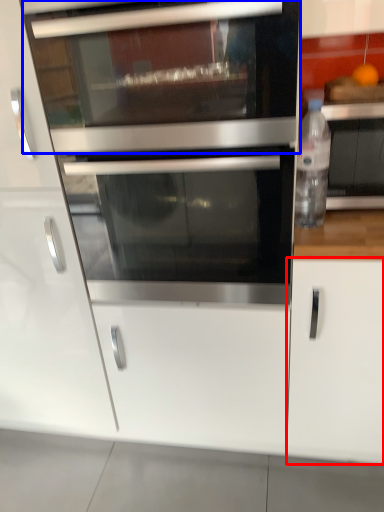
Question: Which object is further to the camera taking this photo, cabinetry (highlighted by a red box) or microwave oven (highlighted by a blue box)?

Choices:
 (A) cabinetry
 (B) microwave oven

Answer: (A)